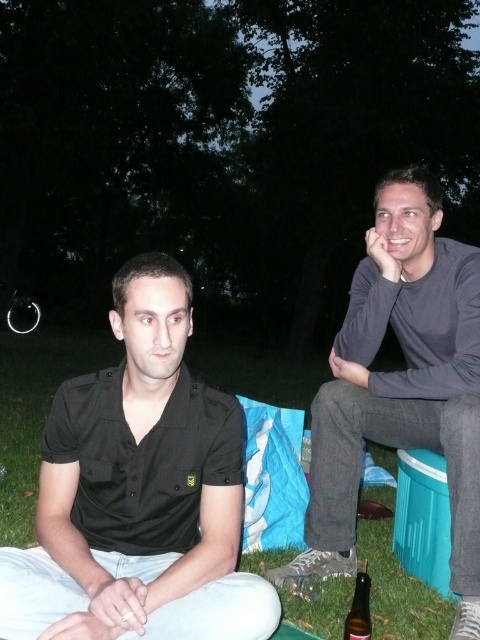
Question: Which point is closer to the camera?

Choices:
 (A) gray cotton shirt at right
 (B) black matte shirt at left
 (C) brown glass bottle at lower right

Answer: (B)

Question: Based on their relative distances, which object is nearer to the black matte shirt at left?

Choices:
 (A) gray cotton shirt at right
 (B) brown glass bottle at lower right

Answer: (B)

Question: Does black matte shirt at left come behind gray cotton shirt at right?

Choices:
 (A) yes
 (B) no

Answer: (B)

Question: Can you confirm if black matte shirt at left is positioned below gray cotton shirt at right?

Choices:
 (A) no
 (B) yes

Answer: (B)

Question: Can you confirm if black matte shirt at left is thinner than brown glass bottle at lower right?

Choices:
 (A) no
 (B) yes

Answer: (A)

Question: Estimate the real-world distances between objects in this image. Which object is closer to the brown glass bottle at lower right?

Choices:
 (A) black matte shirt at left
 (B) gray cotton shirt at right

Answer: (A)